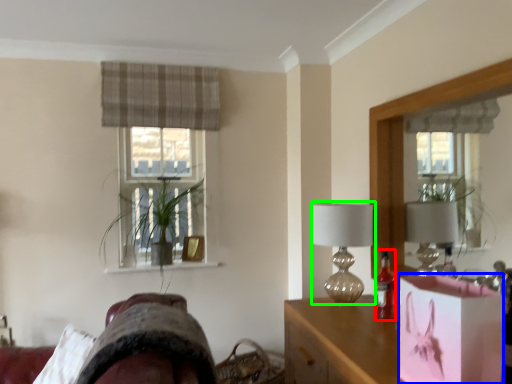
Question: Which object is positioned farthest from bottle (highlighted by a red box)? Select from box (highlighted by a blue box) and table lamp (highlighted by a green box).

Choices:
 (A) box
 (B) table lamp

Answer: (A)